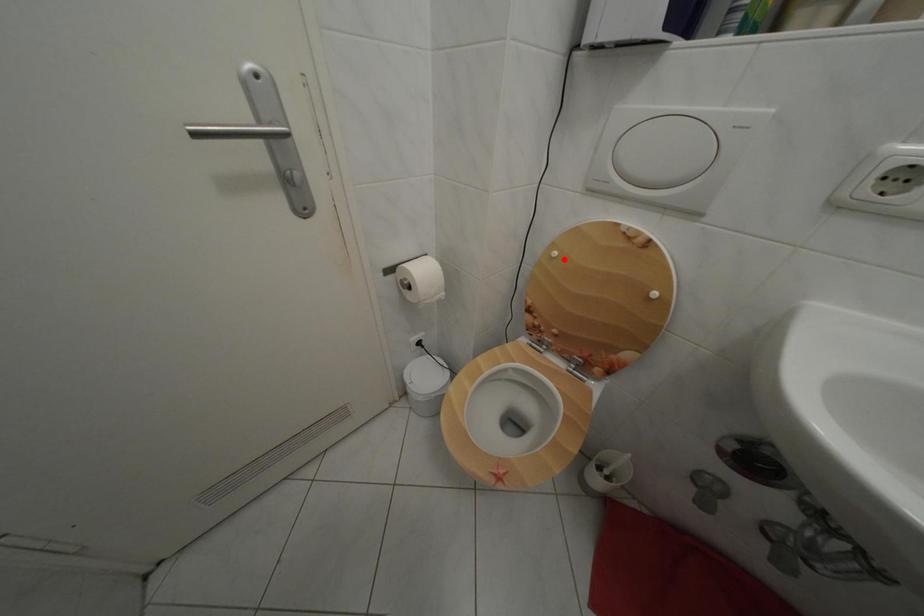
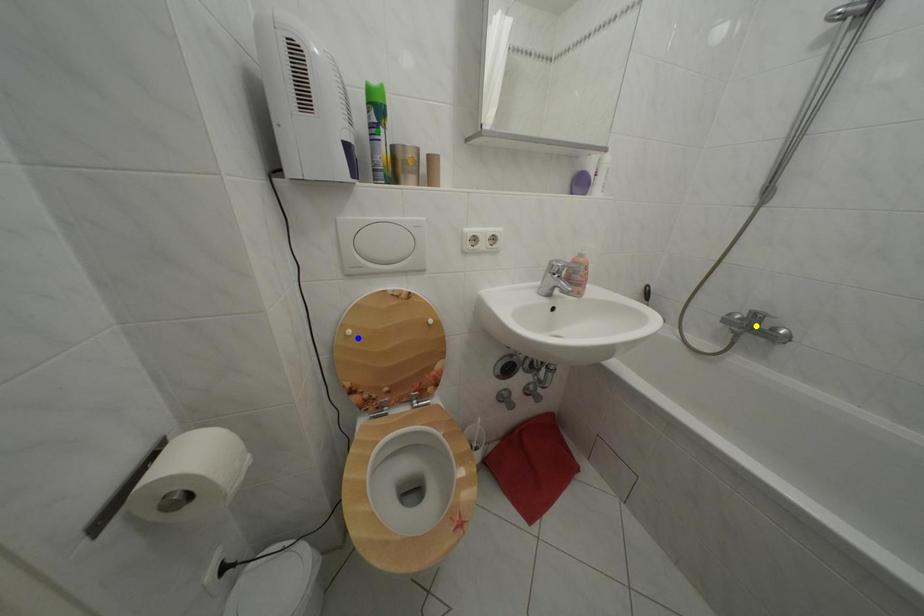
Question: I am providing you with two images of the same scene from different viewpoints. A red point is marked on the first image. You are given multiple points on the second image. Which point in image 2 represents the same 3d spot as the red point in image 1?

Choices:
 (A) green point
 (B) yellow point
 (C) blue point

Answer: (C)